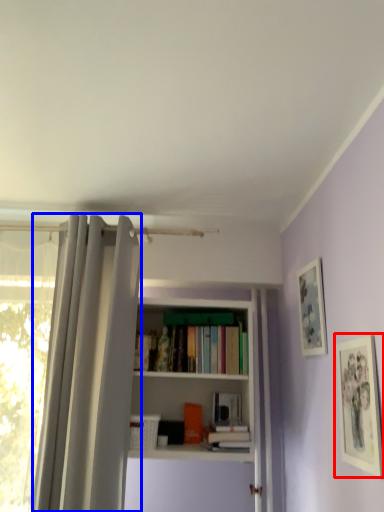
Question: Which point is closer to the camera, picture frame (highlighted by a red box) or shower curtain (highlighted by a blue box)?

Choices:
 (A) picture frame
 (B) shower curtain

Answer: (A)